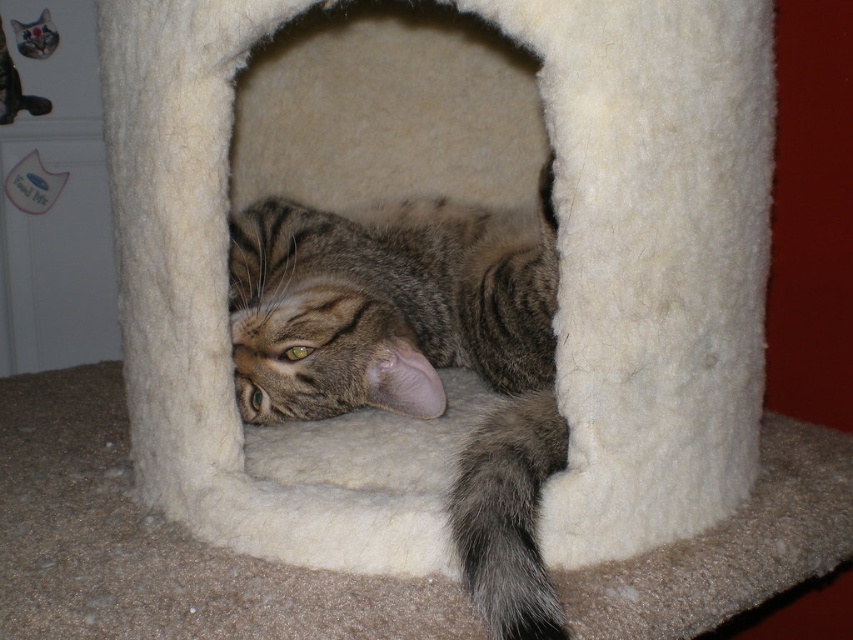
You are a cat owner who wants to place a new toy on the cat house. The toy is 10 cm taller than the tabby fur cat at center. Will the toy fit on the white felt cat bed at center without falling off?

The white felt cat bed at center is taller than the tabby fur cat at center. Since the toy is only 10 cm taller than the cat, it may still fit on the cat bed as long as the bed can support the toy. However, the stability depends on the bed size and the toy dimensions beyond height.

In the scene shown: You are a cat owner who wants to place a new toy on the cat bed. The toy requires 8 inches of space. Can the toy fit on the white felt cat bed at center if the tabby fur cat at center is currently occupying the bed?

The distance between the white felt cat bed at center and the tabby fur cat at center is 7.33 inches. Since the toy requires 8 inches of space, it cannot fit on the white felt cat bed at center while the cat is occupying it.

You are a cat owner who wants to ensure your tabby fur cat at center has enough space to stretch out comfortably in the white felt cat bed at center. Based on the scene description, can the cat fit comfortably in the bed?

The white felt cat bed at center has a larger size compared to tabby fur cat at center, so yes, the cat can fit comfortably in the bed as it is bigger than the cat.